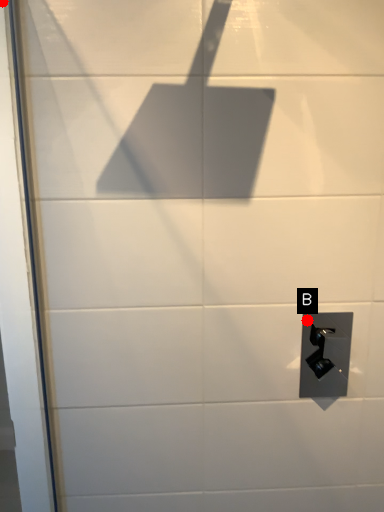
Question: Two points are circled on the image, labeled by A and B beside each circle. Which point appears closest to the camera in this image?

Choices:
 (A) A is closer
 (B) B is closer

Answer: (A)